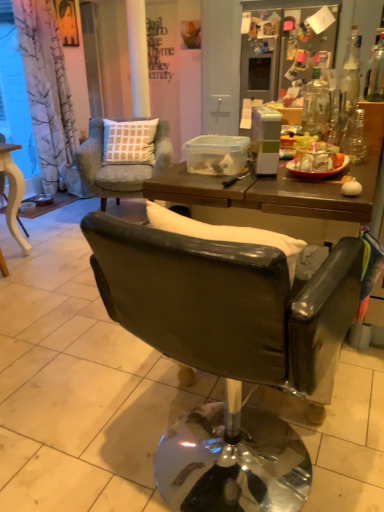
This screenshot has width=384, height=512. Find the location of `free space to the left of leather-like black chair at center, which is the third chair in back-to-front order`. free space to the left of leather-like black chair at center, which is the third chair in back-to-front order is located at coordinates (71, 433).